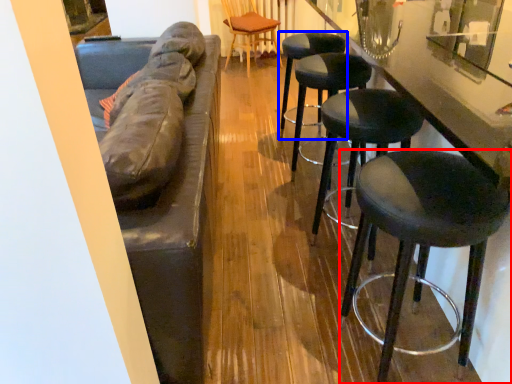
Question: Which point is closer to the camera, stool (highlighted by a red box) or stool (highlighted by a blue box)?

Choices:
 (A) stool
 (B) stool

Answer: (A)